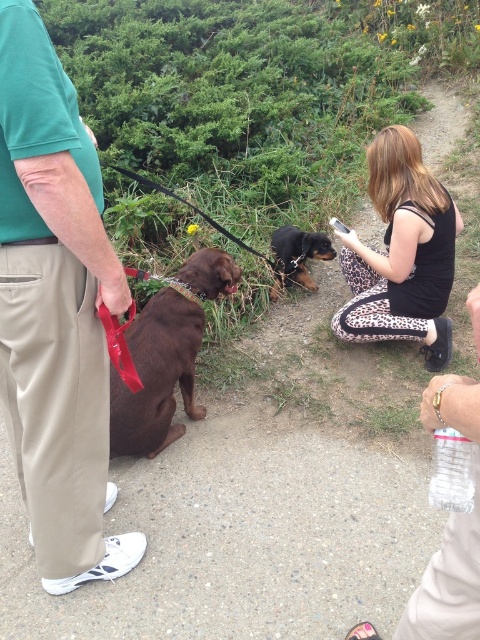
You are a photographer trying to capture a group photo of the green cotton shirt at left and the black and tan fur at center. Based on their heights, which one should you position closer to the camera to ensure both are visible in the frame?

The green cotton shirt at left is much taller than the black and tan fur at center, so you should position the black and tan fur at center closer to the camera to ensure both are visible in the frame.

From the picture: You are a photographer trying to capture a group photo of the green cotton shirt at left and the black and tan fur at center. Based on their positions, which subject should you position closer to the camera to ensure both are in focus?

The green cotton shirt at left should be positioned closer to the camera because it might be wider than the black and tan fur at center, ensuring both fit within the frame.